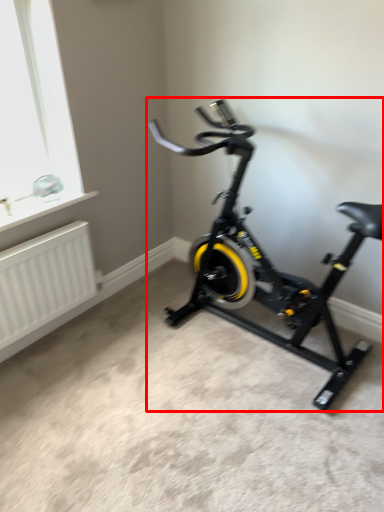
Question: Observing the image, what is the correct spatial positioning of stationary bicycle (annotated by the red box) in reference to radiator?

Choices:
 (A) right
 (B) left

Answer: (A)